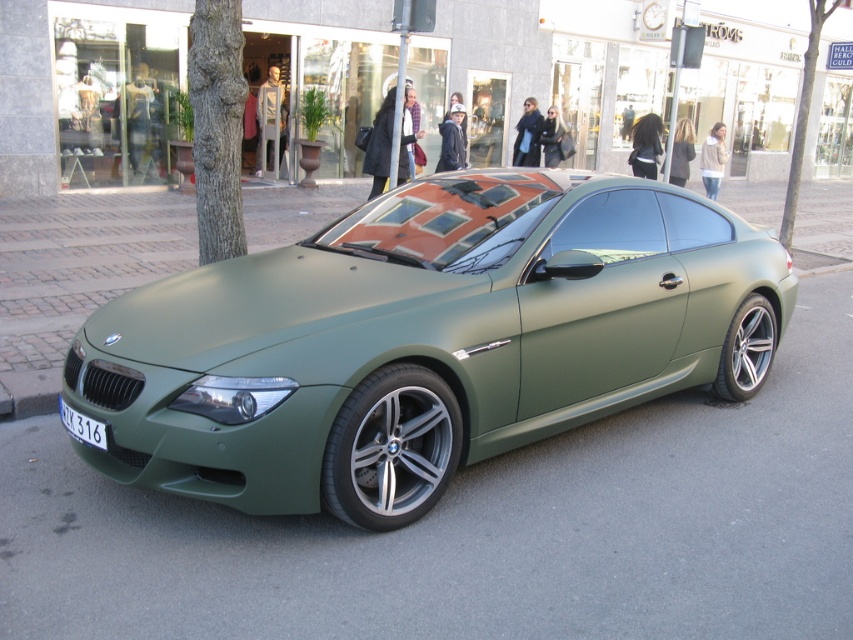
In the scene shown: Between matte green car at center and white plastic license plate at lower left, which one has more height?

matte green car at center is taller.

Does point (344, 326) come in front of point (79, 429)?

Yes, it is in front of point (79, 429).

Between point (715, 333) and point (93, 436), which one is positioned in front?

Positioned in front is point (93, 436).

The width and height of the screenshot is (853, 640). Find the location of `matte green car at center`. matte green car at center is located at coordinates (425, 340).